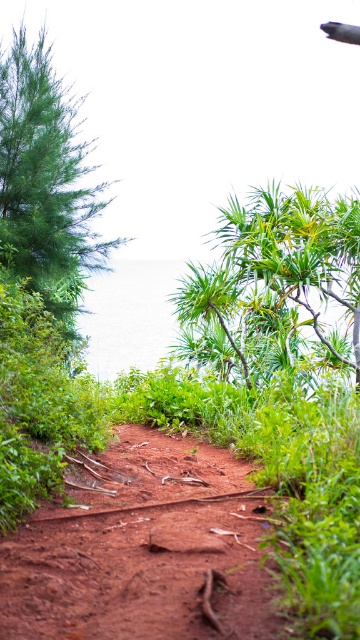
Question: Which point appears farthest from the camera in this image?

Choices:
 (A) (39, 278)
 (B) (353, 237)
 (C) (101, 461)

Answer: (A)

Question: Does dusty red dirt track at center appear under green leafy plant at center?

Choices:
 (A) no
 (B) yes

Answer: (B)

Question: Based on their relative distances, which object is farther from the green matte tree at left?

Choices:
 (A) green leafy plant at center
 (B) dusty red dirt track at center

Answer: (B)

Question: Which object is positioned farthest from the green matte tree at left?

Choices:
 (A) green leafy plant at center
 (B) dusty red dirt track at center

Answer: (B)

Question: Does dusty red dirt track at center lie behind green matte tree at left?

Choices:
 (A) no
 (B) yes

Answer: (A)

Question: In this image, where is dusty red dirt track at center located relative to green matte tree at left?

Choices:
 (A) below
 (B) above

Answer: (A)